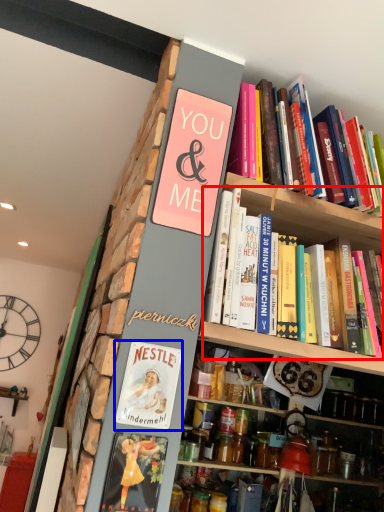
Question: Among these objects, which one is nearest to the camera, book (highlighted by a red box) or book cover (highlighted by a blue box)?

Choices:
 (A) book
 (B) book cover

Answer: (A)